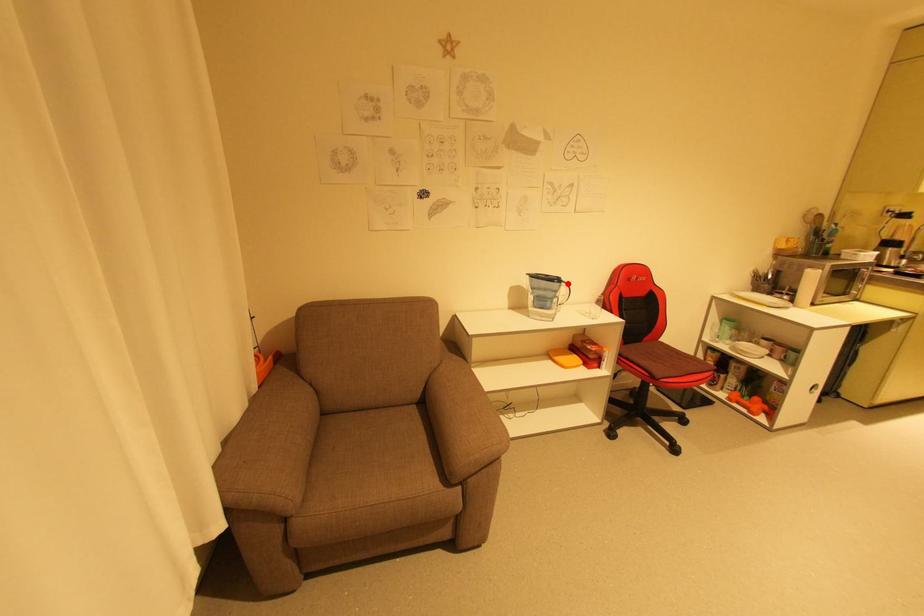
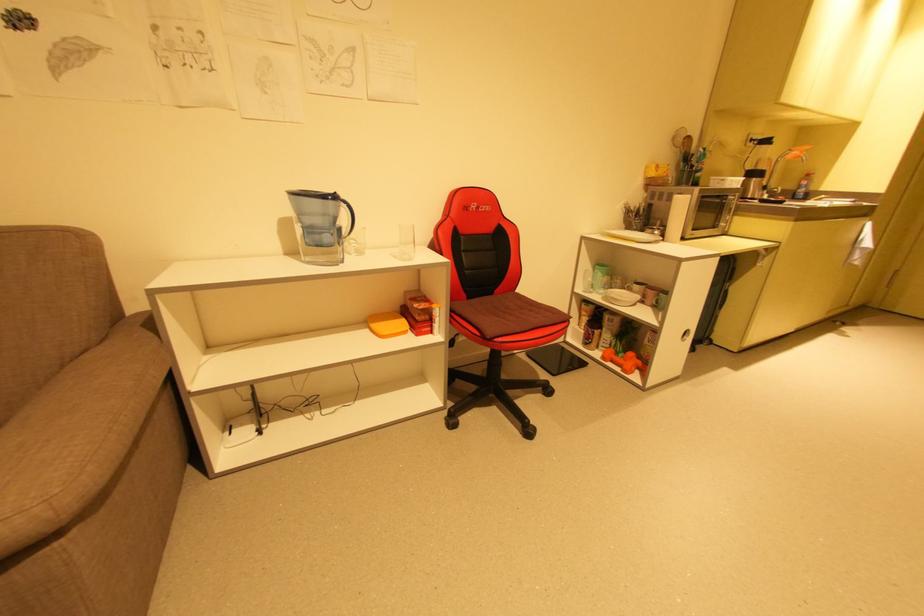
Locate, in the second image, the point that corresponds to the highlighted location in the first image.

(346, 204)